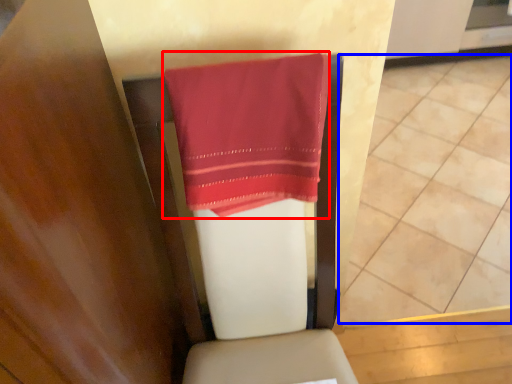
Question: Among these objects, which one is farthest to the camera, towel (highlighted by a red box) or tile (highlighted by a blue box)?

Choices:
 (A) towel
 (B) tile

Answer: (B)